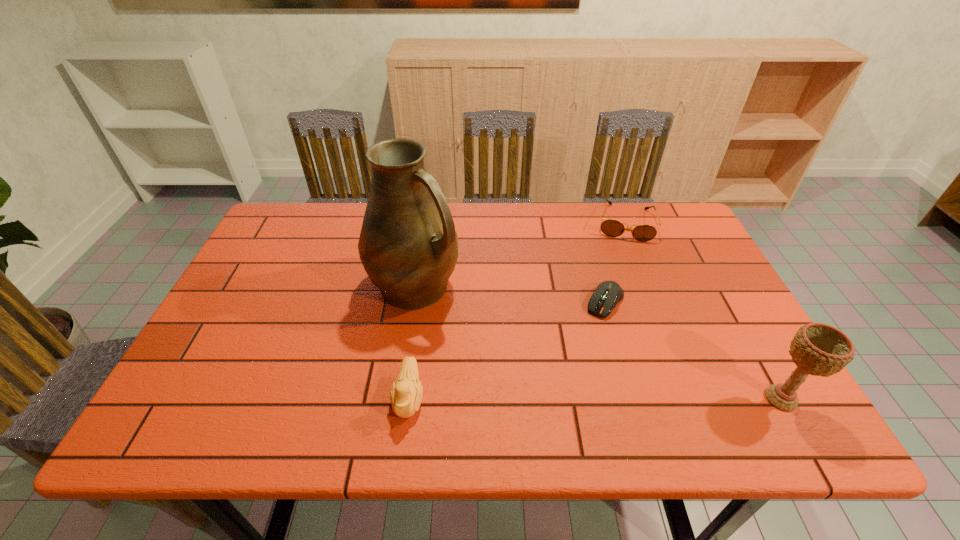
Select which object is the second closest to the farthest object. Please provide its 2D coordinates. Your answer should be formatted as a tuple, i.e. [(x, y)], where the tuple contains the x and y coordinates of a point satisfying the conditions above.

[(408, 246)]

Select which object is the second closest to the duckling. Please provide its 2D coordinates. Your answer should be formatted as a tuple, i.e. [(x, y)], where the tuple contains the x and y coordinates of a point satisfying the conditions above.

[(607, 294)]

You are a GUI agent. You are given a task and a screenshot of the screen. Output one action in this format:
    pyautogui.click(x=<x>, y=<y>)
    Task: Click on the vacant space that satisfies the following two spatial constraints: 1. on the front side of the pitcher; 2. on the right side of the shortest object
    The image size is (960, 540).
    Given the screenshot: What is the action you would take?
    pyautogui.click(x=412, y=302)